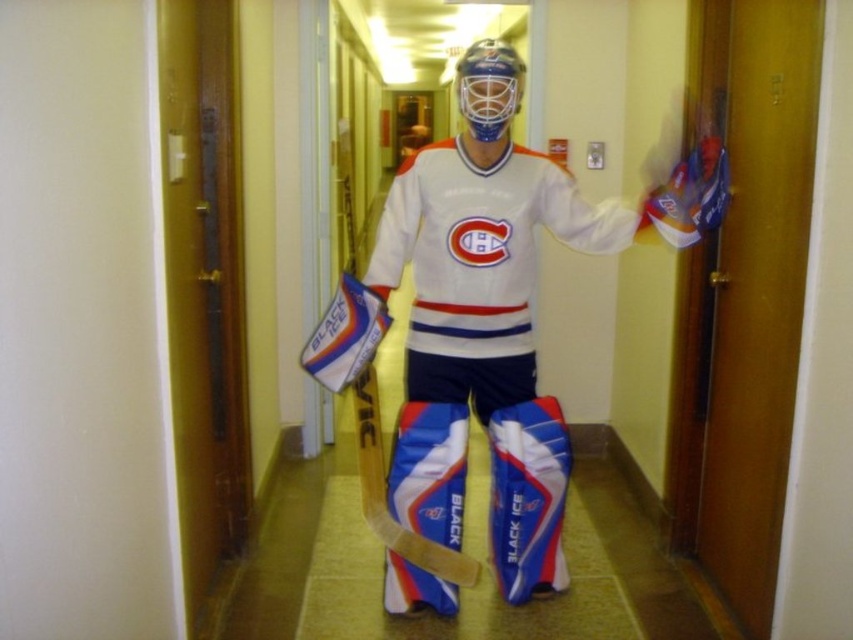
Does white matte jersey at center lie in front of blue and white composite hockey stick at center?

Yes, white matte jersey at center is in front of blue and white composite hockey stick at center.

Which of these two, white matte jersey at center or blue and white composite hockey stick at center, stands taller?

white matte jersey at center is taller.

Where is `white matte jersey at center`? white matte jersey at center is located at coordinates click(476, 336).